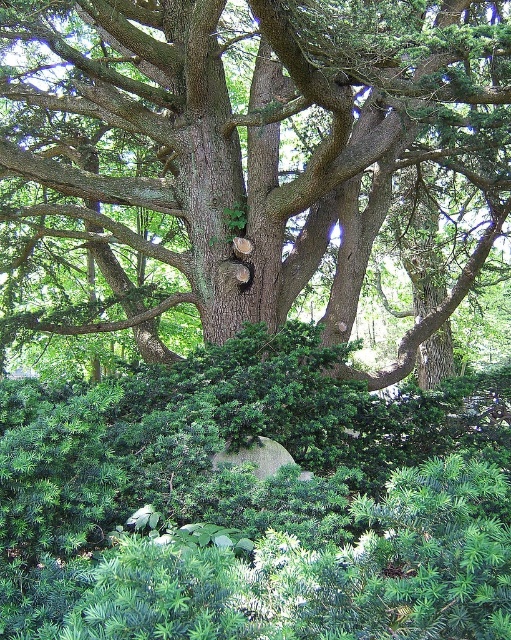
You are standing in front of a large tree with a rough trunk and a dense canopy. There is a point marked at coordinates [256,502]. What is located at that point?

At point [256,502] lies green needle like bush at center.